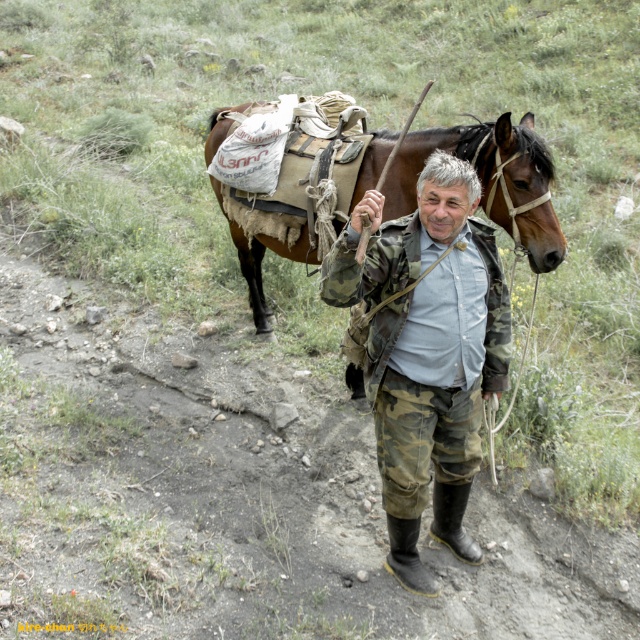
You are standing at the origin point in the image and see two points labeled as point (214, 118) and point (449, 500). Which point is closer to you?

Point (449, 500) is closer to you because it is in front of point (214, 118).